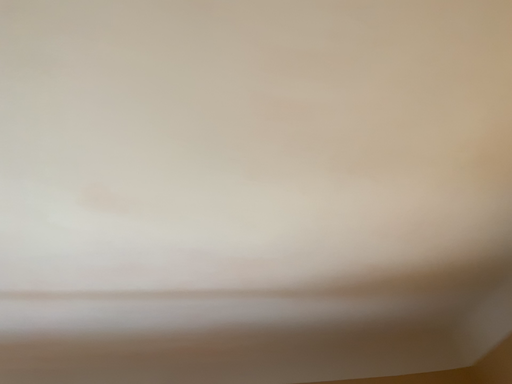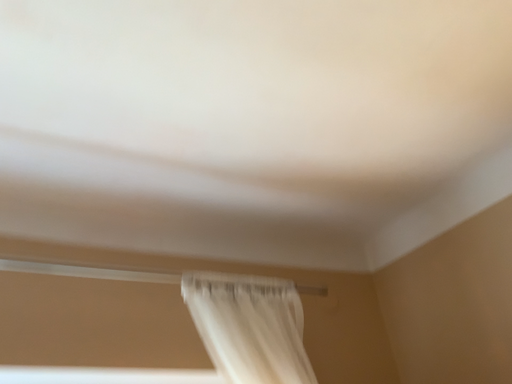
Question: How did the camera likely rotate when shooting the video?

Choices:
 (A) rotated upward
 (B) rotated downward

Answer: (B)